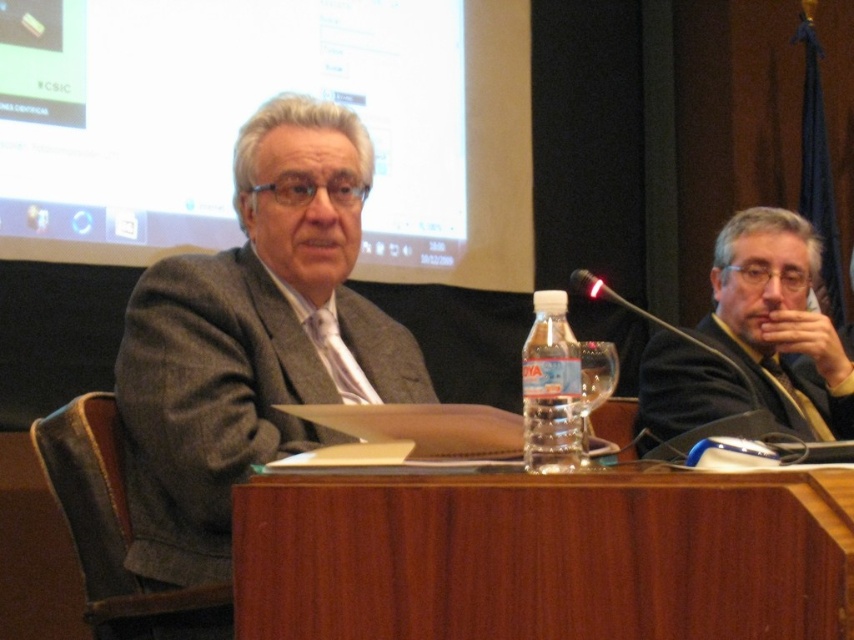
Question: Among these points, which one is nearest to the camera?

Choices:
 (A) (220, 269)
 (B) (440, 497)
 (C) (809, 348)

Answer: (B)

Question: Is gray wool suit at center to the left of translucent plastic bottle at center from the viewer's perspective?

Choices:
 (A) no
 (B) yes

Answer: (B)

Question: From the image, what is the correct spatial relationship of gray wool suit at center in relation to translucent plastic bottle at center?

Choices:
 (A) right
 (B) left

Answer: (B)

Question: Which object is farther from the camera taking this photo?

Choices:
 (A) translucent plastic bottle at center
 (B) wooden table at center

Answer: (A)

Question: Is gray wool suit at center below dark gray suit at right?

Choices:
 (A) no
 (B) yes

Answer: (B)

Question: Which point is farther to the camera?

Choices:
 (A) (436, 621)
 (B) (185, 500)
 (C) (727, 269)

Answer: (C)